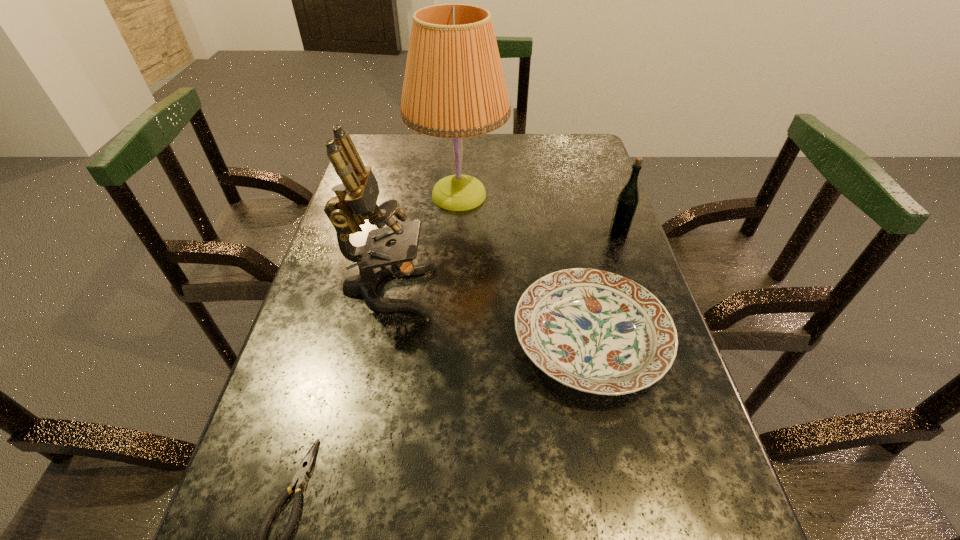
Find the location of a particular element. vacant space that is in between the beer bottle and the second tallest object is located at coordinates (504, 261).

Locate an element on the screen. The width and height of the screenshot is (960, 540). free spot between the fourth nearest object and the microscope is located at coordinates (504, 261).

Locate an element on the screen. vacant area that lies between the third tallest object and the microscope is located at coordinates (504, 261).

Find the location of a particular element. the closest object to the lamp is located at coordinates (356, 197).

Locate an element on the screen. object that can be found as the second closest to the microscope is located at coordinates (598, 332).

Find the location of a particular element. The height and width of the screenshot is (540, 960). vacant space that satisfies the following two spatial constraints: 1. at the eyepieces of the microscope; 2. on the right side of the second shortest object is located at coordinates point(378,340).

Identify the location of free spot that satisfies the following two spatial constraints: 1. on the side of the lamp near the pull switch; 2. on the right side of the beer bottle. (457, 232).